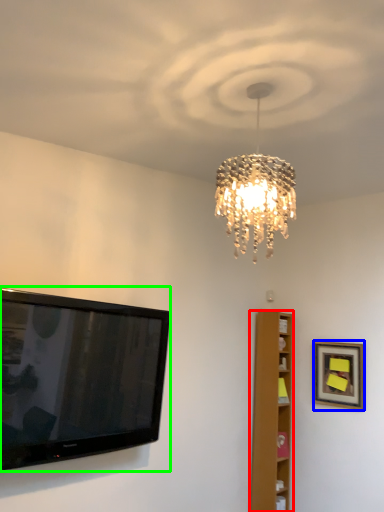
Question: Which object is the closest to the furniture (highlighted by a red box)? Choose among these: picture frame (highlighted by a blue box) or television (highlighted by a green box).

Choices:
 (A) picture frame
 (B) television

Answer: (A)